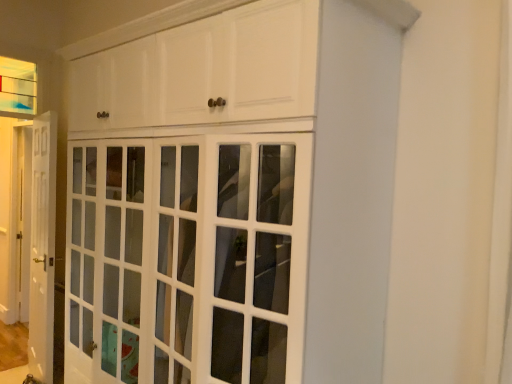
Question: Considering the relative sizes of white glossy cabinet at center and clear glass window at upper left in the image provided, is white glossy cabinet at center bigger than clear glass window at upper left?

Choices:
 (A) no
 (B) yes

Answer: (B)

Question: Does white glossy cabinet at center have a greater height compared to clear glass window at upper left?

Choices:
 (A) yes
 (B) no

Answer: (A)

Question: Can you confirm if white glossy cabinet at center is positioned to the right of clear glass window at upper left?

Choices:
 (A) no
 (B) yes

Answer: (B)

Question: Is white glossy cabinet at center beside clear glass window at upper left?

Choices:
 (A) no
 (B) yes

Answer: (A)

Question: From the image's perspective, does white glossy cabinet at center appear lower than clear glass window at upper left?

Choices:
 (A) yes
 (B) no

Answer: (A)

Question: Could you tell me if white glossy cabinet at center is turned towards clear glass window at upper left?

Choices:
 (A) no
 (B) yes

Answer: (A)

Question: Is white glossy cabinet at center smaller than white glossy door at left?

Choices:
 (A) yes
 (B) no

Answer: (B)

Question: Can you confirm if white glossy cabinet at center is shorter than white glossy door at left?

Choices:
 (A) yes
 (B) no

Answer: (A)

Question: Does white glossy cabinet at center have a larger size compared to white glossy door at left?

Choices:
 (A) no
 (B) yes

Answer: (B)

Question: Is white glossy cabinet at center to the left of white glossy door at left from the viewer's perspective?

Choices:
 (A) yes
 (B) no

Answer: (B)

Question: Is white glossy cabinet at center positioned with its back to white glossy door at left?

Choices:
 (A) no
 (B) yes

Answer: (A)

Question: From the image's perspective, is white glossy cabinet at center located above white glossy door at left?

Choices:
 (A) yes
 (B) no

Answer: (A)

Question: Could you tell me if white glossy door at left is facing white glossy cabinet at center?

Choices:
 (A) yes
 (B) no

Answer: (B)